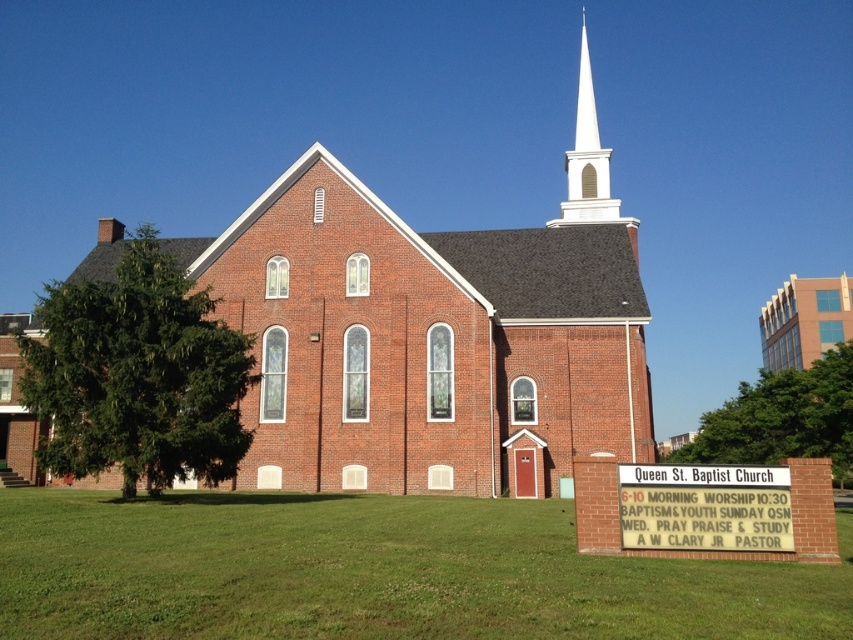
Is brick building at upper right above white smooth steeple at upper center?

Actually, brick building at upper right is below white smooth steeple at upper center.

The height and width of the screenshot is (640, 853). Describe the element at coordinates (804, 321) in the screenshot. I see `brick building at upper right` at that location.

Find the location of a particular element. brick building at upper right is located at coordinates (804, 321).

Is white plastic sign at center smaller than brick building at upper right?

Indeed, white plastic sign at center has a smaller size compared to brick building at upper right.

At what (x,y) coordinates should I click in order to perform the action: click on white plastic sign at center. Please return your answer as a coordinate pair (x, y). This screenshot has height=640, width=853. Looking at the image, I should click on (705, 506).

Who is more distant from viewer, (764, 506) or (793, 305)?

Point (793, 305)

Where is `white plastic sign at center`? The height and width of the screenshot is (640, 853). white plastic sign at center is located at coordinates (705, 506).

At what (x,y) coordinates should I click in order to perform the action: click on brick church steeple at center. Please return your answer as a coordinate pair (x, y). This screenshot has width=853, height=640. Looking at the image, I should click on (433, 333).

Is brick church steeple at center taller than white plastic sign at center?

Yes, brick church steeple at center is taller than white plastic sign at center.

Image resolution: width=853 pixels, height=640 pixels. What do you see at coordinates (433, 333) in the screenshot?
I see `brick church steeple at center` at bounding box center [433, 333].

This screenshot has width=853, height=640. In order to click on brick church steeple at center in this screenshot , I will do `click(433, 333)`.